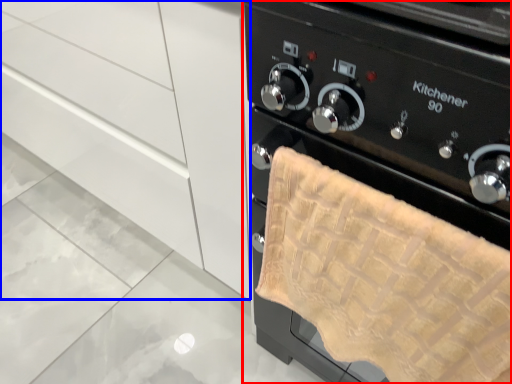
Question: Which object is closer to the camera taking this photo, home appliance (highlighted by a red box) or cabinetry (highlighted by a blue box)?

Choices:
 (A) home appliance
 (B) cabinetry

Answer: (A)